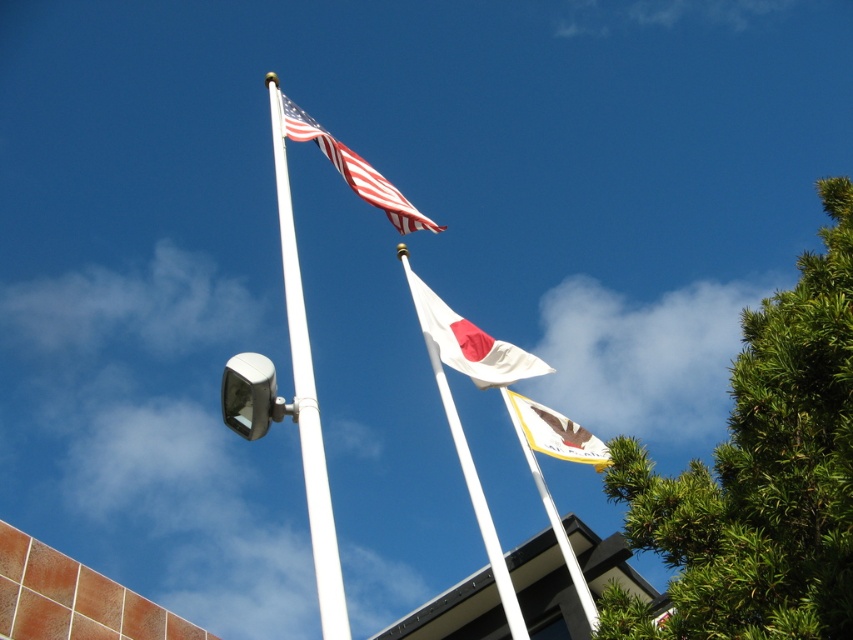
Question: Which object is the closest to the green leafy tree at right?

Choices:
 (A) white matte flag pole at center
 (B) matte white flag at upper left

Answer: (A)

Question: Among these points, which one is nearest to the camera?

Choices:
 (A) (821, 464)
 (B) (560, 433)

Answer: (A)

Question: Observing the image, what is the correct spatial positioning of white matte flag at center in reference to satin silver traffic light at upper center?

Choices:
 (A) above
 (B) below

Answer: (A)

Question: Can you confirm if white metallic pole at upper left is positioned above white matte flag at center?

Choices:
 (A) no
 (B) yes

Answer: (B)

Question: Does green leafy tree at right have a lesser width compared to white matte flag pole at center?

Choices:
 (A) yes
 (B) no

Answer: (B)

Question: Which object appears closest to the camera in this image?

Choices:
 (A) matte white flag at upper left
 (B) yellow fabric flag at center

Answer: (A)